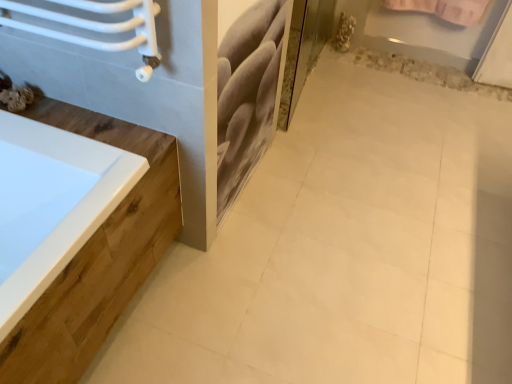
This screenshot has width=512, height=384. What do you see at coordinates (346, 251) in the screenshot?
I see `white glossy ceramic tile at center` at bounding box center [346, 251].

Measure the distance between white glossy ceramic tile at center and camera.

white glossy ceramic tile at center and camera are 4.29 feet apart.

Measure the distance between point [274,378] and camera.

A distance of 1.37 meters exists between point [274,378] and camera.

Identify the location of white glossy ceramic tile at center. The width and height of the screenshot is (512, 384). (346, 251).

What do you see at coordinates (306, 51) in the screenshot? I see `clear glass screen door at upper center` at bounding box center [306, 51].

At what (x,y) coordinates should I click in order to perform the action: click on clear glass screen door at upper center. Please return your answer as a coordinate pair (x, y). This screenshot has height=384, width=512. Looking at the image, I should click on [x=306, y=51].

Where is `white glossy ceramic tile at center`? The height and width of the screenshot is (384, 512). white glossy ceramic tile at center is located at coordinates (346, 251).

In the image, is white glossy ceramic tile at center on the left side or the right side of clear glass screen door at upper center?

In the image, white glossy ceramic tile at center appears on the right side of clear glass screen door at upper center.

In the image, is white glossy ceramic tile at center positioned in front of or behind clear glass screen door at upper center?

white glossy ceramic tile at center is in front of clear glass screen door at upper center.

Which is less distant, (372, 244) or (311, 53)?

The point (372, 244) is in front.

From the image's perspective, is white glossy ceramic tile at center below clear glass screen door at upper center?

Yes.

From a real-world perspective, which is physically above, white glossy ceramic tile at center or clear glass screen door at upper center?

clear glass screen door at upper center is physically above.

Considering the sizes of objects white glossy ceramic tile at center and clear glass screen door at upper center in the image provided, who is wider, white glossy ceramic tile at center or clear glass screen door at upper center?

white glossy ceramic tile at center is wider.

Which of these two, white glossy ceramic tile at center or clear glass screen door at upper center, stands shorter?

Standing shorter between the two is white glossy ceramic tile at center.

From the picture: Between white glossy ceramic tile at center and clear glass screen door at upper center, which one has larger size?

Bigger between the two is white glossy ceramic tile at center.

Would you say white glossy ceramic tile at center is inside or outside clear glass screen door at upper center?

white glossy ceramic tile at center is not enclosed by clear glass screen door at upper center.

Would you say white glossy ceramic tile at center is a long distance from clear glass screen door at upper center?

Actually, white glossy ceramic tile at center and clear glass screen door at upper center are a little close together.

Is white glossy ceramic tile at center positioned with its back to clear glass screen door at upper center?

No, white glossy ceramic tile at center is not facing away from clear glass screen door at upper center.

How many degrees apart are the facing directions of white glossy ceramic tile at center and clear glass screen door at upper center?

There is a 82.5-degree angle between the facing directions of white glossy ceramic tile at center and clear glass screen door at upper center.

At what (x,y) coordinates should I click in order to perform the action: click on ceramic tile on the right of the clear glass screen door at upper center. Please return your answer as a coordinate pair (x, y). Looking at the image, I should click on (346, 251).

Looking at this image, visually, is clear glass screen door at upper center positioned to the left or to the right of white glossy ceramic tile at center?

From the image, it's evident that clear glass screen door at upper center is to the left of white glossy ceramic tile at center.

Is the position of clear glass screen door at upper center less distant than that of white glossy ceramic tile at center?

No.

Is point (312, 53) in front of point (339, 82)?

No, (312, 53) is behind (339, 82).

From the image's perspective, is clear glass screen door at upper center on white glossy ceramic tile at center?

Yes, from the image's perspective, clear glass screen door at upper center is on top of white glossy ceramic tile at center.

From a real-world perspective, is clear glass screen door at upper center positioned over white glossy ceramic tile at center based on gravity?

Yes, from a real-world perspective, clear glass screen door at upper center is above white glossy ceramic tile at center.

Is clear glass screen door at upper center wider than white glossy ceramic tile at center?

Result: No.

Is clear glass screen door at upper center taller than white glossy ceramic tile at center?

Correct, clear glass screen door at upper center is much taller as white glossy ceramic tile at center.

Based on the photo, who is bigger, clear glass screen door at upper center or white glossy ceramic tile at center?

white glossy ceramic tile at center is bigger.

Can white glossy ceramic tile at center be found inside clear glass screen door at upper center?

No, white glossy ceramic tile at center is not inside clear glass screen door at upper center.

Is clear glass screen door at upper center directly adjacent to white glossy ceramic tile at center?

clear glass screen door at upper center and white glossy ceramic tile at center are clearly separated.

Could you tell me if clear glass screen door at upper center is turned towards white glossy ceramic tile at center?

No, clear glass screen door at upper center is not aimed at white glossy ceramic tile at center.

In the scene shown: How many degrees apart are the facing directions of clear glass screen door at upper center and white glossy ceramic tile at center?

The angle between the facing direction of clear glass screen door at upper center and the facing direction of white glossy ceramic tile at center is 82.5 degrees.

How distant is clear glass screen door at upper center from white glossy ceramic tile at center?

clear glass screen door at upper center is 33.62 inches from white glossy ceramic tile at center.

This screenshot has width=512, height=384. Find the location of `screen door behind the white glossy ceramic tile at center`. screen door behind the white glossy ceramic tile at center is located at coordinates (306, 51).

Locate an element on the screen. This screenshot has height=384, width=512. ceramic tile that is in front of the clear glass screen door at upper center is located at coordinates (346, 251).

Find the location of `screen door above the white glossy ceramic tile at center (from the image's perspective)`. screen door above the white glossy ceramic tile at center (from the image's perspective) is located at coordinates (306, 51).